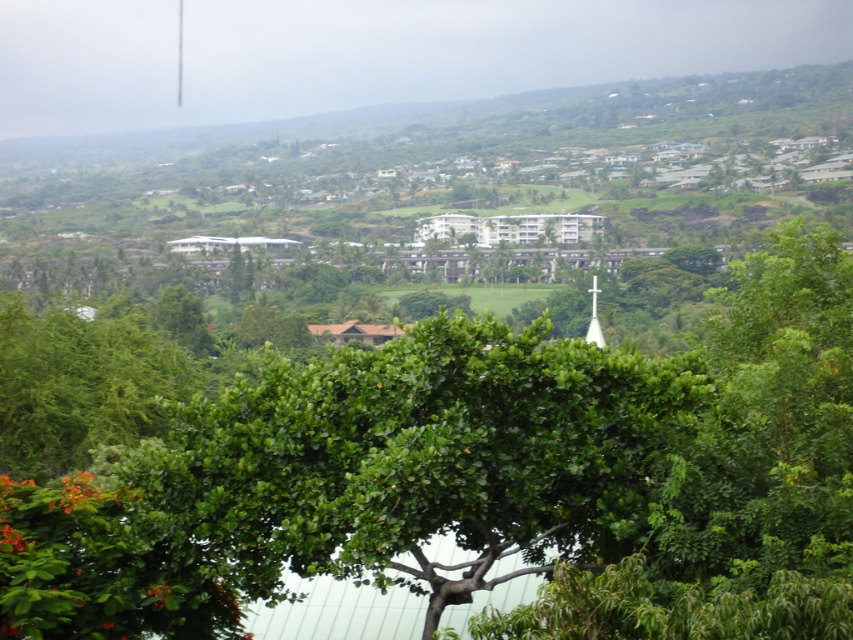
Question: Which point is closer to the camera?

Choices:
 (A) green leafy tree at center
 (B) white glass spire at center

Answer: (A)

Question: Which object appears farthest from the camera in this image?

Choices:
 (A) green leafy tree at center
 (B) white glass spire at center

Answer: (B)

Question: Is green leafy tree at center bigger than white glass spire at center?

Choices:
 (A) yes
 (B) no

Answer: (B)

Question: Does green leafy tree at center have a lesser width compared to white glass spire at center?

Choices:
 (A) yes
 (B) no

Answer: (A)

Question: Is green leafy tree at center closer to camera compared to white glass spire at center?

Choices:
 (A) no
 (B) yes

Answer: (B)